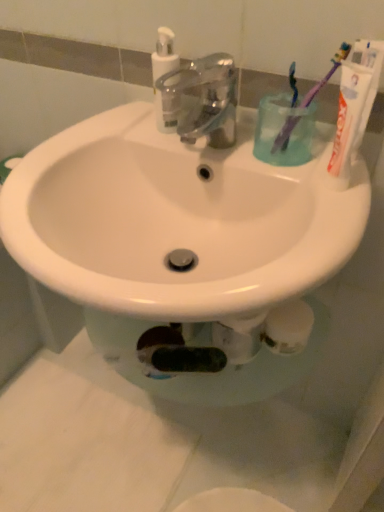
In order to click on vacant area in front of white matte toothpaste at upper right in this screenshot , I will do `click(318, 240)`.